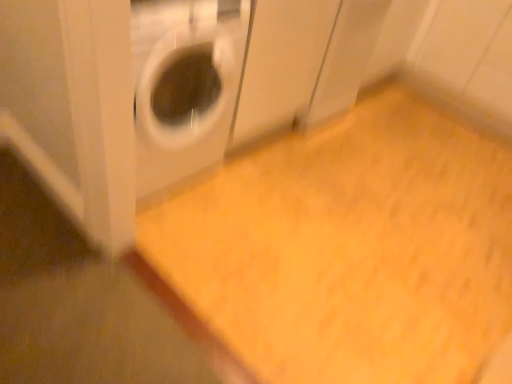
Measure the distance between white glossy washing machine at upper left and camera.

The depth of white glossy washing machine at upper left is 4.53 feet.

Describe the element at coordinates (184, 84) in the screenshot. This screenshot has height=384, width=512. I see `white glossy washing machine at upper left` at that location.

Find the location of a particular element. white glossy washing machine at upper left is located at coordinates (184, 84).

Where is `white glossy washing machine at upper left`? Image resolution: width=512 pixels, height=384 pixels. white glossy washing machine at upper left is located at coordinates (184, 84).